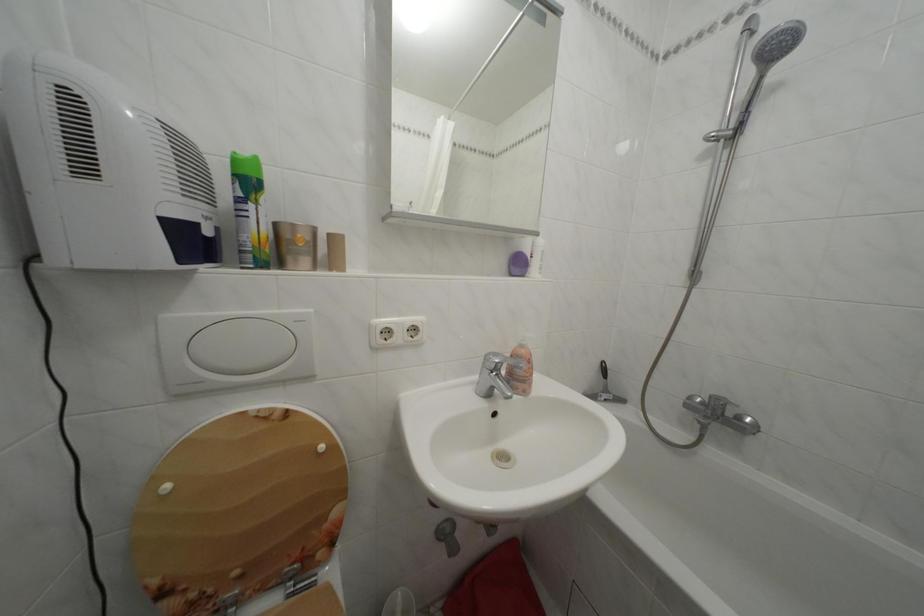
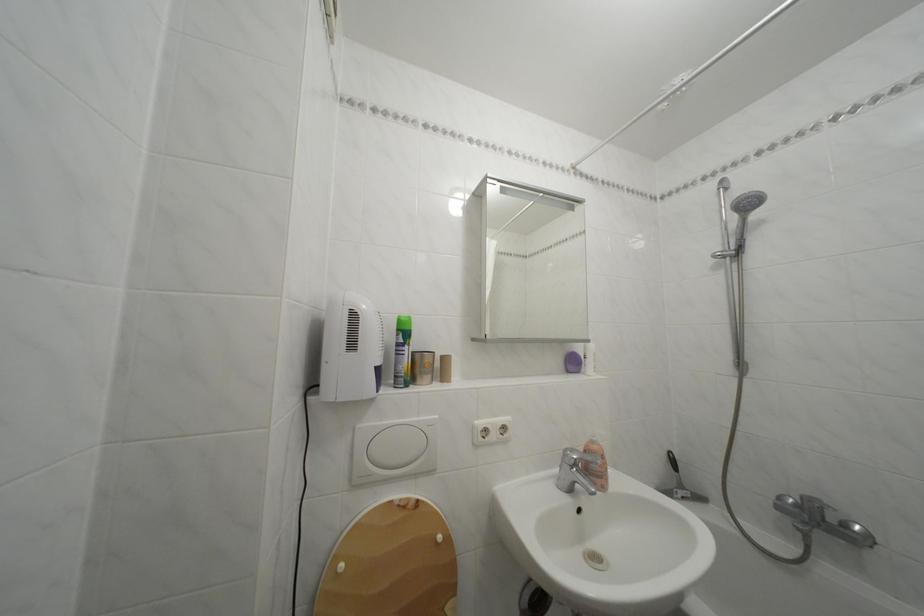
Locate, in the second image, the point that corresponds to pixel 614 397 in the first image.

(689, 492)